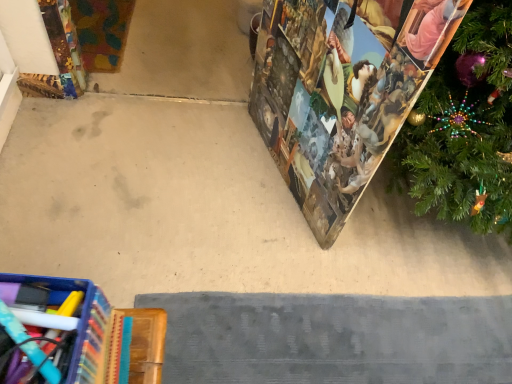
What do you see at coordinates (342, 91) in the screenshot? I see `printed paper advent calendar at right` at bounding box center [342, 91].

You are a GUI agent. You are given a task and a screenshot of the screen. Output one action in this format:
    pyautogui.click(x=<x>, y=<y>)
    Task: Click on the printed paper advent calendar at right
    
    Given the screenshot: What is the action you would take?
    pyautogui.click(x=342, y=91)

What do you see at coordinates (206, 211) in the screenshot? I see `beige carpet at center` at bounding box center [206, 211].

What is the approximate width of beige carpet at center?

beige carpet at center is 2.23 meters wide.

What are the coordinates of `beige carpet at center` in the screenshot? It's located at [206, 211].

Locate an element on the screen. printed paper advent calendar at right is located at coordinates (342, 91).

Which object is positioned more to the left, beige carpet at center or printed paper advent calendar at right?

From the viewer's perspective, beige carpet at center appears more on the left side.

In the scene shown: Is the depth of beige carpet at center greater than that of printed paper advent calendar at right?

That is True.

Which point is more distant from viewer, [163,109] or [297,127]?

The point [163,109] is behind.

From the image's perspective, between beige carpet at center and printed paper advent calendar at right, which one is located above?

printed paper advent calendar at right.

From a real-world perspective, which is physically below, beige carpet at center or printed paper advent calendar at right?

beige carpet at center, from a real-world perspective.

Between beige carpet at center and printed paper advent calendar at right, which one has larger width?

beige carpet at center.

Is beige carpet at center taller than printed paper advent calendar at right?

No.

Between beige carpet at center and printed paper advent calendar at right, which one has smaller size?

beige carpet at center.

Is printed paper advent calendar at right completely or partially inside beige carpet at center?

No, printed paper advent calendar at right is located outside of beige carpet at center.

Is beige carpet at center placed right next to printed paper advent calendar at right?

No, beige carpet at center is not next to printed paper advent calendar at right.

Could you tell me if beige carpet at center is facing printed paper advent calendar at right?

No, beige carpet at center does not turn towards printed paper advent calendar at right.

What's the angular difference between beige carpet at center and printed paper advent calendar at right's facing directions?

There is a 149-degree angle between the facing directions of beige carpet at center and printed paper advent calendar at right.

The height and width of the screenshot is (384, 512). What are the coordinates of `concrete directly beneath the printed paper advent calendar at right (from a real-world perspective)` in the screenshot? It's located at (206, 211).

Considering the relative positions of printed paper advent calendar at right and beige carpet at center in the image provided, is printed paper advent calendar at right to the left of beige carpet at center from the viewer's perspective?

No.

Which object is closer to the camera taking this photo, printed paper advent calendar at right or beige carpet at center?

printed paper advent calendar at right is more forward.

Which is behind, point (292, 179) or point (83, 223)?

The point (292, 179) is farther.

From the image's perspective, between printed paper advent calendar at right and beige carpet at center, which one is located above?

printed paper advent calendar at right is shown above in the image.

From a real-world perspective, which object stands above the other?

printed paper advent calendar at right.

Which of these two, printed paper advent calendar at right or beige carpet at center, is thinner?

printed paper advent calendar at right.

Considering the sizes of printed paper advent calendar at right and beige carpet at center in the image, is printed paper advent calendar at right taller or shorter than beige carpet at center?

Clearly, printed paper advent calendar at right is taller compared to beige carpet at center.

Is printed paper advent calendar at right bigger than beige carpet at center?

Yes, printed paper advent calendar at right is bigger than beige carpet at center.

Is printed paper advent calendar at right outside of beige carpet at center?

Yes, printed paper advent calendar at right is outside of beige carpet at center.

Are printed paper advent calendar at right and beige carpet at center beside each other?

No, printed paper advent calendar at right is not making contact with beige carpet at center.

Is printed paper advent calendar at right positioned with its back to beige carpet at center?

No.

How many degrees apart are the facing directions of printed paper advent calendar at right and beige carpet at center?

149 degrees.

Where is `christmas decoration that is above the beige carpet at center (from a real-world perspective)`? This screenshot has width=512, height=384. christmas decoration that is above the beige carpet at center (from a real-world perspective) is located at coordinates (342, 91).

Where is `concrete behind the printed paper advent calendar at right`? concrete behind the printed paper advent calendar at right is located at coordinates (206, 211).

Identify the location of concrete that is on the left side of printed paper advent calendar at right. The image size is (512, 384). (x=206, y=211).